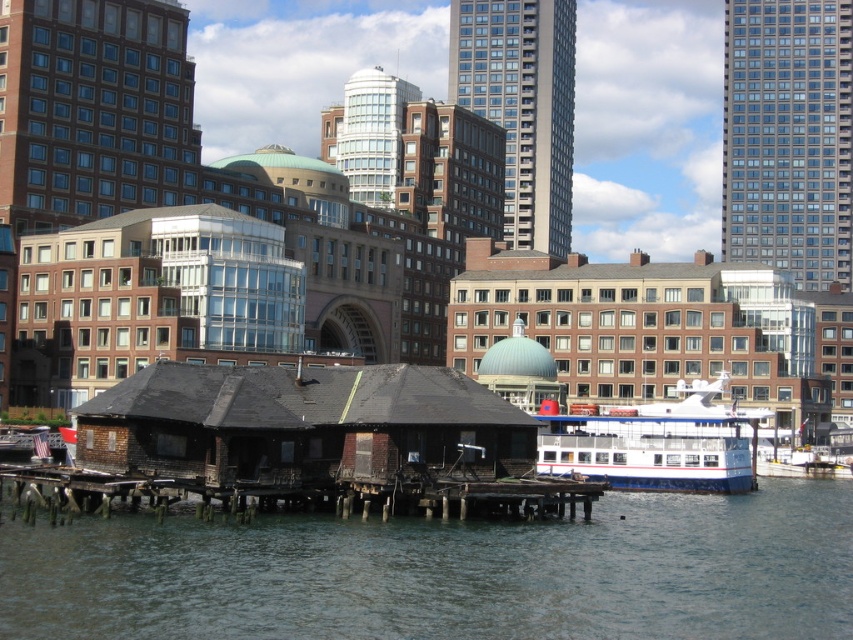
Who is taller, weathered wood dock at center or white glossy boat at lower right?

With more height is white glossy boat at lower right.

Who is positioned more to the left, weathered wood dock at center or white glossy boat at lower right?

weathered wood dock at center is more to the left.

Measure the distance between point (86, 500) and camera.

A distance of 58.97 meters exists between point (86, 500) and camera.

Where is `weathered wood dock at center`? Image resolution: width=853 pixels, height=640 pixels. weathered wood dock at center is located at coordinates (308, 493).

Does dark gray water at lower center appear over white glossy boat at lower right?

No, dark gray water at lower center is not above white glossy boat at lower right.

Can you confirm if dark gray water at lower center is bigger than white glossy boat at lower right?

Indeed, dark gray water at lower center has a larger size compared to white glossy boat at lower right.

The height and width of the screenshot is (640, 853). What do you see at coordinates (445, 572) in the screenshot?
I see `dark gray water at lower center` at bounding box center [445, 572].

Image resolution: width=853 pixels, height=640 pixels. Identify the location of dark gray water at lower center. (445, 572).

Can you confirm if smooth glass skyscraper at upper right is smaller than white glossy boat at lower right?

Incorrect, smooth glass skyscraper at upper right is not smaller in size than white glossy boat at lower right.

Between smooth glass skyscraper at upper right and white glossy boat at lower right, which one appears on the right side from the viewer's perspective?

smooth glass skyscraper at upper right

The width and height of the screenshot is (853, 640). Identify the location of smooth glass skyscraper at upper right. (788, 138).

You are a GUI agent. You are given a task and a screenshot of the screen. Output one action in this format:
    pyautogui.click(x=<x>, y=<y>)
    Task: Click on the smooth glass skyscraper at upper right
    
    Given the screenshot: What is the action you would take?
    pyautogui.click(x=788, y=138)